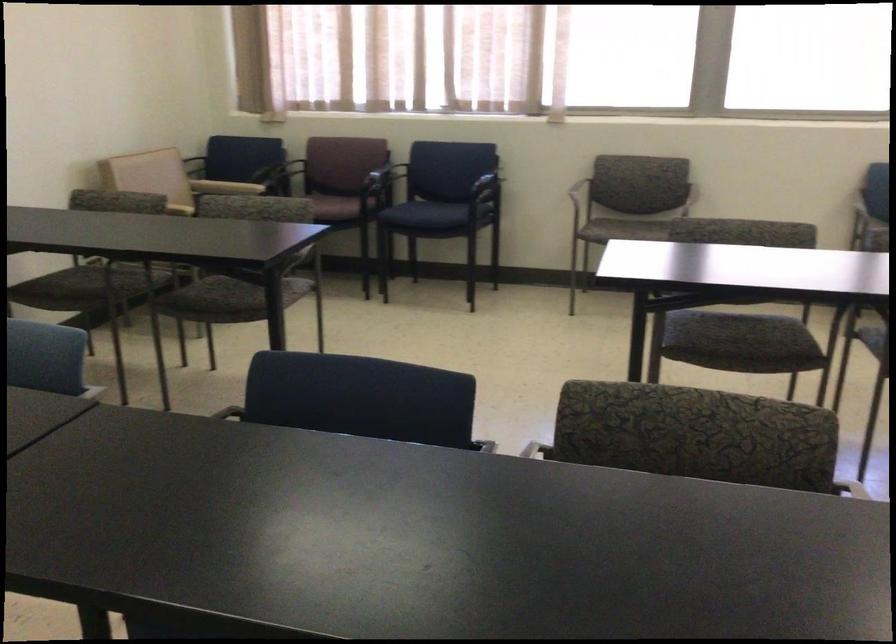
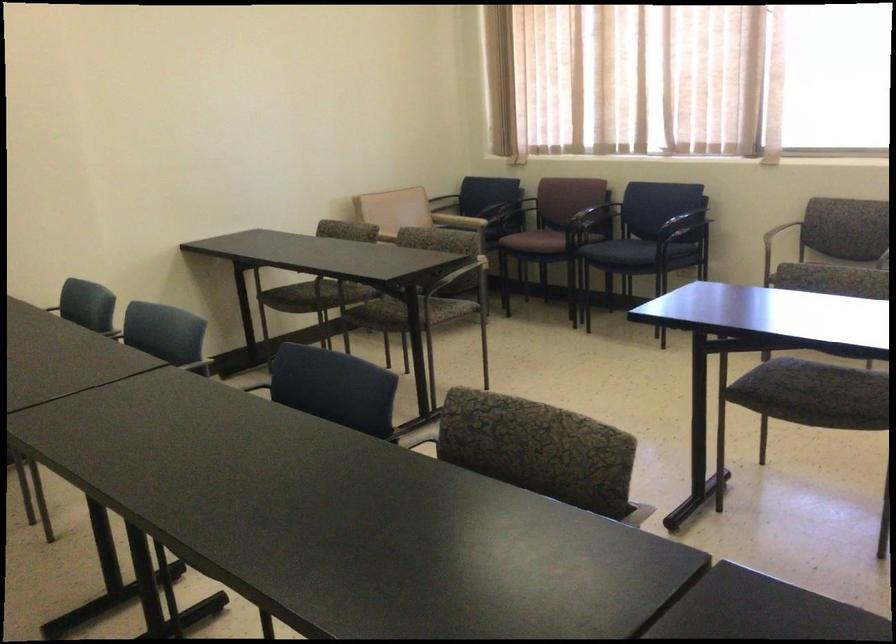
Question: I am providing you with two images of the same scene from different viewpoints. Which of the following objects are not visible in image2?

Choices:
 (A) tan chair armrest
 (B) beige chair sitting surface
 (C) blue chair sitting surface
 (D) none of these

Answer: (D)